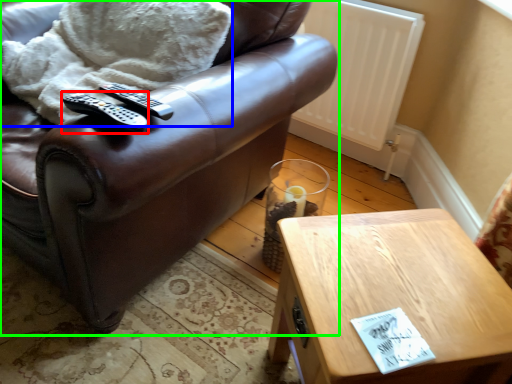
Question: Which object is the farthest from remote (highlighted by a red box)? Choose among these: blanket (highlighted by a blue box) or chair (highlighted by a green box).

Choices:
 (A) blanket
 (B) chair

Answer: (B)